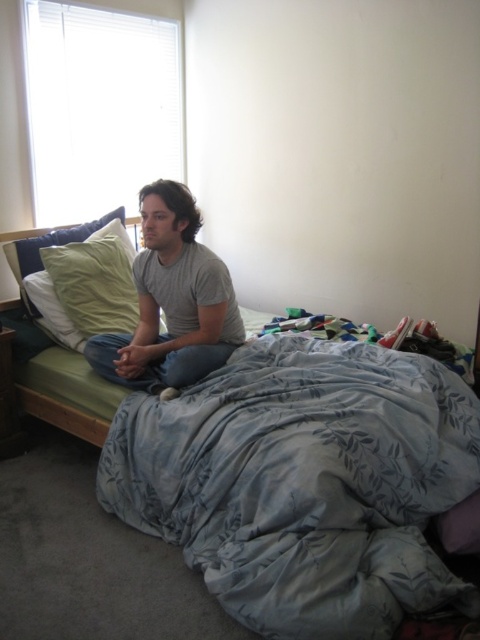
Question: Estimate the real-world distances between objects in this image. Which object is closer to the blue leaf-patterned blanket at center?

Choices:
 (A) green fabric pillow at upper left
 (B) gray cotton shirt at center

Answer: (B)

Question: Among these points, which one is nearest to the camera?

Choices:
 (A) pos(339,378)
 (B) pos(148,221)

Answer: (A)

Question: Can you confirm if blue leaf-patterned blanket at center is positioned below green fabric pillow at upper left?

Choices:
 (A) no
 (B) yes

Answer: (B)

Question: Which of these objects is positioned farthest from the blue leaf-patterned blanket at center?

Choices:
 (A) green fabric pillow at upper left
 (B) gray cotton shirt at center

Answer: (A)

Question: In this image, where is blue leaf-patterned blanket at center located relative to green fabric pillow at upper left?

Choices:
 (A) left
 (B) right

Answer: (B)

Question: Can you confirm if blue leaf-patterned blanket at center is positioned to the right of gray cotton shirt at center?

Choices:
 (A) yes
 (B) no

Answer: (A)